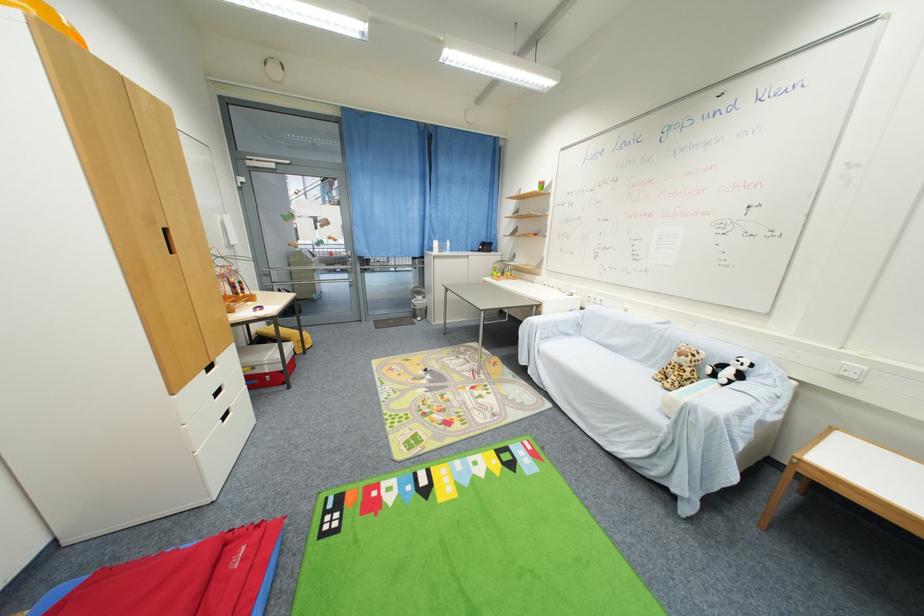
Locate an element on the screen. sofa sitting surface is located at coordinates (589, 355).